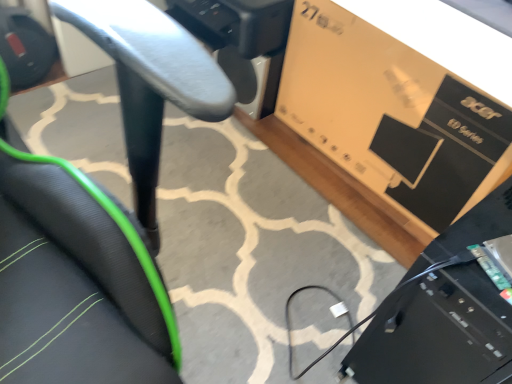
Describe the element at coordinates (437, 332) in the screenshot. I see `black plastic computer at lower right` at that location.

The width and height of the screenshot is (512, 384). What do you see at coordinates (75, 279) in the screenshot?
I see `black mesh chair at center` at bounding box center [75, 279].

Locate an element on the screen. This screenshot has width=512, height=384. black plastic computer at lower right is located at coordinates (437, 332).

Between black plastic computer at lower right and black mesh chair at center, which one has less height?

With less height is black mesh chair at center.

Is the position of black plastic computer at lower right more distant than that of black mesh chair at center?

No, it is in front of black mesh chair at center.

Is black plastic computer at lower right positioned with its back to black mesh chair at center?

No, black plastic computer at lower right is not facing away from black mesh chair at center.

Which point is more distant from viewer, (316, 44) or (397, 322)?

Positioned behind is point (316, 44).

Does matte brown cardboard box at upper right come in front of black plastic computer at lower right?

No, it is behind black plastic computer at lower right.

Is matte brown cardboard box at upper right with black plastic computer at lower right?

There is a gap between matte brown cardboard box at upper right and black plastic computer at lower right.

From a real-world perspective, is matte brown cardboard box at upper right positioned above or below black plastic computer at lower right?

matte brown cardboard box at upper right is situated lower than black plastic computer at lower right in the real world.

Is black mesh chair at center facing away from matte brown cardboard box at upper right?

No, black mesh chair at center is not facing away from matte brown cardboard box at upper right.

Consider the image. How different are the orientations of black mesh chair at center and matte brown cardboard box at upper right in degrees?

89.8 degrees.

Does black mesh chair at center have a lesser width compared to matte brown cardboard box at upper right?

In fact, black mesh chair at center might be wider than matte brown cardboard box at upper right.

Which is more to the right, black mesh chair at center or matte brown cardboard box at upper right?

Positioned to the right is matte brown cardboard box at upper right.

Looking at this image, in terms of size, does matte brown cardboard box at upper right appear bigger or smaller than black mesh chair at center?

Clearly, matte brown cardboard box at upper right is smaller in size than black mesh chair at center.

Is matte brown cardboard box at upper right taller than black mesh chair at center?

Indeed, matte brown cardboard box at upper right has a greater height compared to black mesh chair at center.

In the scene shown: How much distance is there between matte brown cardboard box at upper right and black mesh chair at center?

The distance of matte brown cardboard box at upper right from black mesh chair at center is 30.48 inches.

Considering the positions of objects matte brown cardboard box at upper right and black mesh chair at center in the image provided, who is in front, matte brown cardboard box at upper right or black mesh chair at center?

black mesh chair at center is in front.

Is black mesh chair at center in front of or behind black plastic computer at lower right in the image?

In the image, black mesh chair at center appears behind black plastic computer at lower right.

From the image's perspective, between black mesh chair at center and black plastic computer at lower right, who is located below?

From the image's view, black plastic computer at lower right is below.

Is point (100, 331) closer or farther from the camera than point (453, 275)?

Point (100, 331).

Could you measure the distance between black plastic computer at lower right and matte brown cardboard box at upper right?

black plastic computer at lower right is 50.32 centimeters away from matte brown cardboard box at upper right.

Does point (436, 343) lie behind point (343, 95)?

No, it is not.

Does black plastic computer at lower right contain matte brown cardboard box at upper right?

No, matte brown cardboard box at upper right is not inside black plastic computer at lower right.

From the image's perspective, is black plastic computer at lower right located beneath matte brown cardboard box at upper right?

Indeed, from the image's perspective, black plastic computer at lower right is shown beneath matte brown cardboard box at upper right.

This screenshot has width=512, height=384. In order to click on chair that is behind the black plastic computer at lower right in this screenshot , I will do pyautogui.click(x=75, y=279).

The height and width of the screenshot is (384, 512). I want to click on cardboard box lying above the black plastic computer at lower right (from the image's perspective), so click(398, 103).

Considering their positions, is matte brown cardboard box at upper right positioned further to black mesh chair at center than black plastic computer at lower right?

matte brown cardboard box at upper right is further to black mesh chair at center.

Based on their spatial positions, is black mesh chair at center or matte brown cardboard box at upper right further from black plastic computer at lower right?

matte brown cardboard box at upper right is further to black plastic computer at lower right.

In the scene shown: Estimate the real-world distances between objects in this image. Which object is closer to matte brown cardboard box at upper right, black plastic computer at lower right or black mesh chair at center?

Based on the image, black plastic computer at lower right appears to be nearer to matte brown cardboard box at upper right.

Considering their positions, is matte brown cardboard box at upper right positioned further to black plastic computer at lower right than black mesh chair at center?

matte brown cardboard box at upper right.

Estimate the real-world distances between objects in this image. Which object is closer to black mesh chair at center, black plastic computer at lower right or matte brown cardboard box at upper right?

black plastic computer at lower right.

Considering their positions, is black mesh chair at center positioned closer to matte brown cardboard box at upper right than black plastic computer at lower right?

black plastic computer at lower right lies closer to matte brown cardboard box at upper right than the other object.

You are a GUI agent. You are given a task and a screenshot of the screen. Output one action in this format:
    pyautogui.click(x=<x>, y=<y>)
    Task: Click on the cardboard box located between black mesh chair at center and black plastic computer at lower right in the left-right direction
    
    Given the screenshot: What is the action you would take?
    pyautogui.click(x=398, y=103)